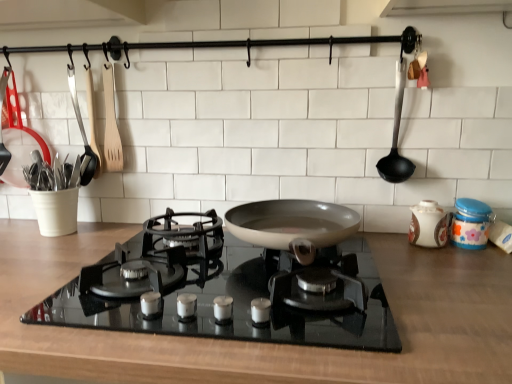
What are the coordinates of `vacant space underneath white plastic utensil holder at left, placed as the fifth kitchen appliance when sorted from right to left (from a real-world perspective)` in the screenshot? It's located at (17, 225).